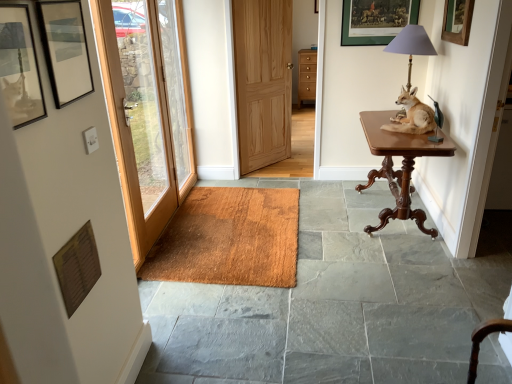
I want to click on free spot above brown textured mat at center (from a real-world perspective), so click(232, 230).